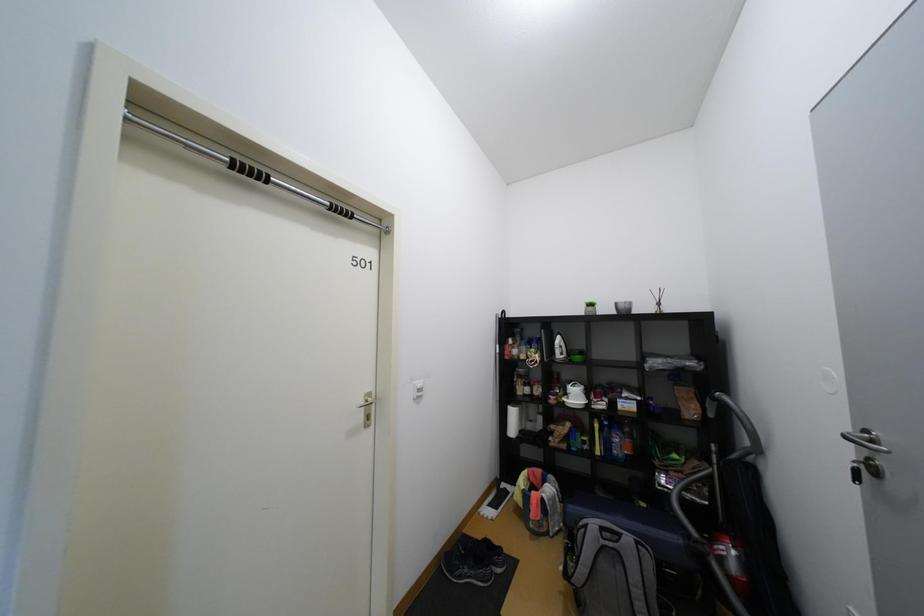
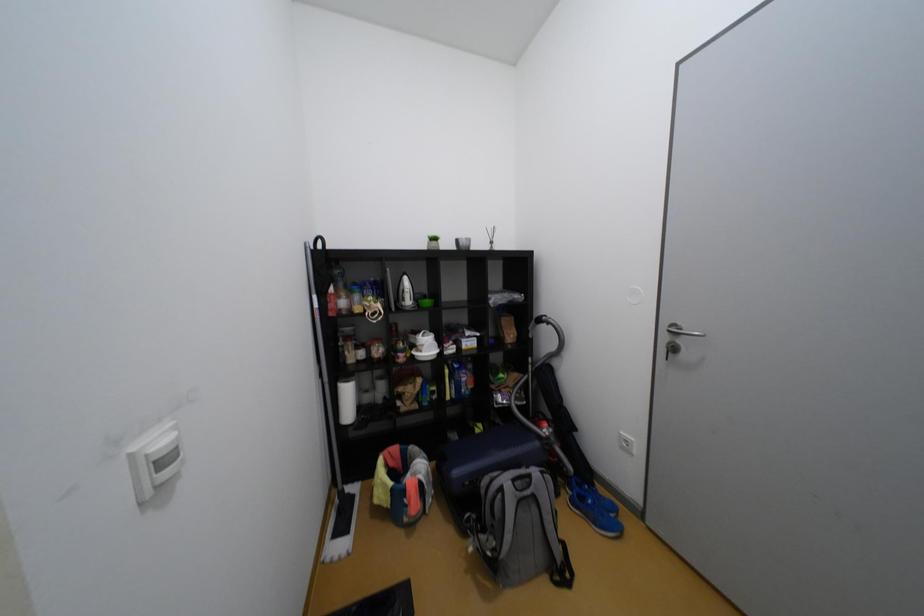
Question: The camera is either moving clockwise (left) or counter-clockwise (right) around the object. The first image is from the beginning of the video and the second image is from the end. Is the camera moving left or right when shooting the video?

Choices:
 (A) Left
 (B) Right

Answer: (A)